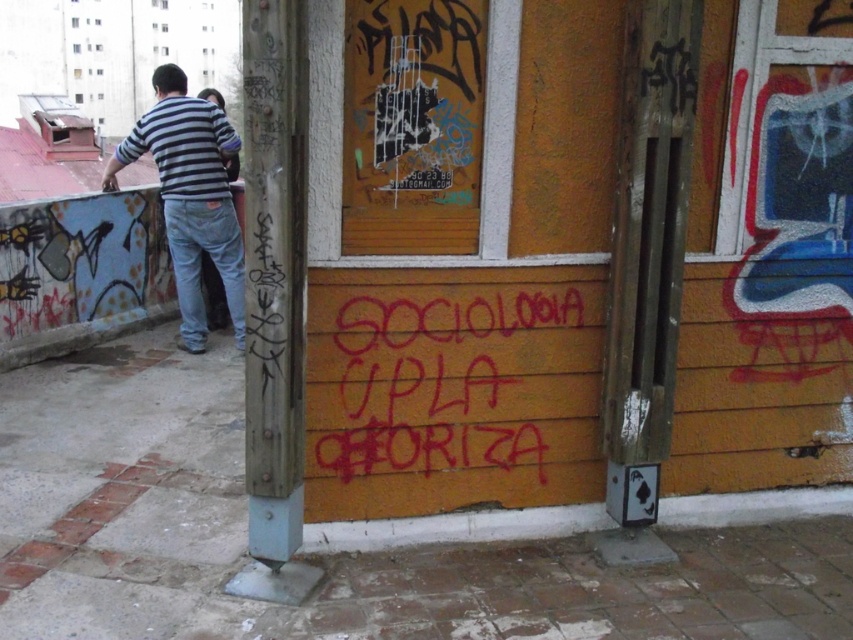
You are an urban explorer standing in front of the wooden structure. You notice the red graffiti at center and the striped cotton shirt at left. Which object is positioned lower in the scene?

The red graffiti at center is positioned below the striped cotton shirt at left, so it is lower in the scene.

You are an artist planning to paint a mural on a wall. You observe the red graffiti at center and the striped cotton shirt at left in the scene. Which object takes up more space visually?

The striped cotton shirt at left takes up more visual space than the red graffiti at center because the red graffiti at center is smaller than striped cotton shirt at left according to the description.

You are standing in front of the wooden structure with graffiti. You notice two points marked on the wall at coordinates point (352, 428) and point (178, 230). If you want to touch both points with your finger, which point should you reach for first?

You should reach for point (352, 428) first because it is closer to you than point (178, 230).